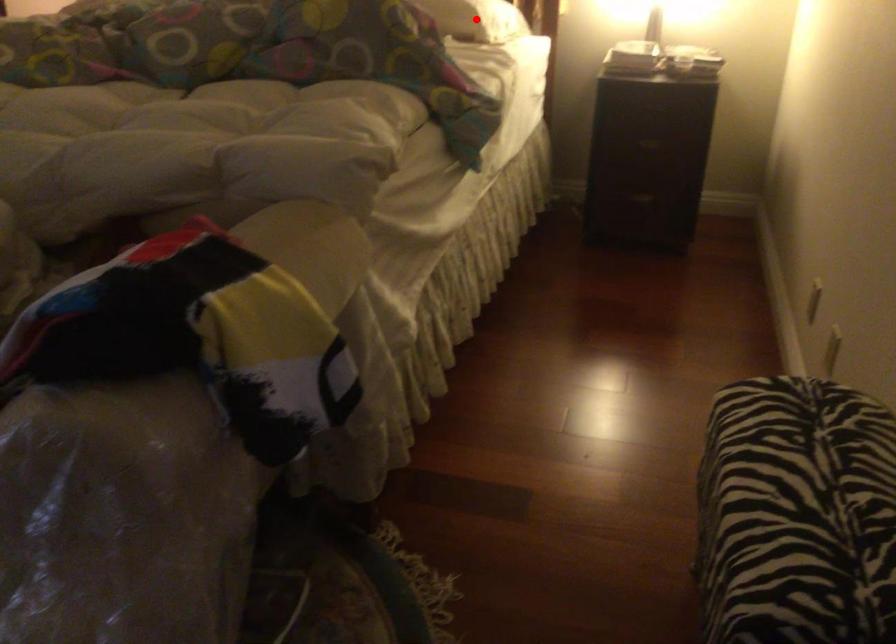
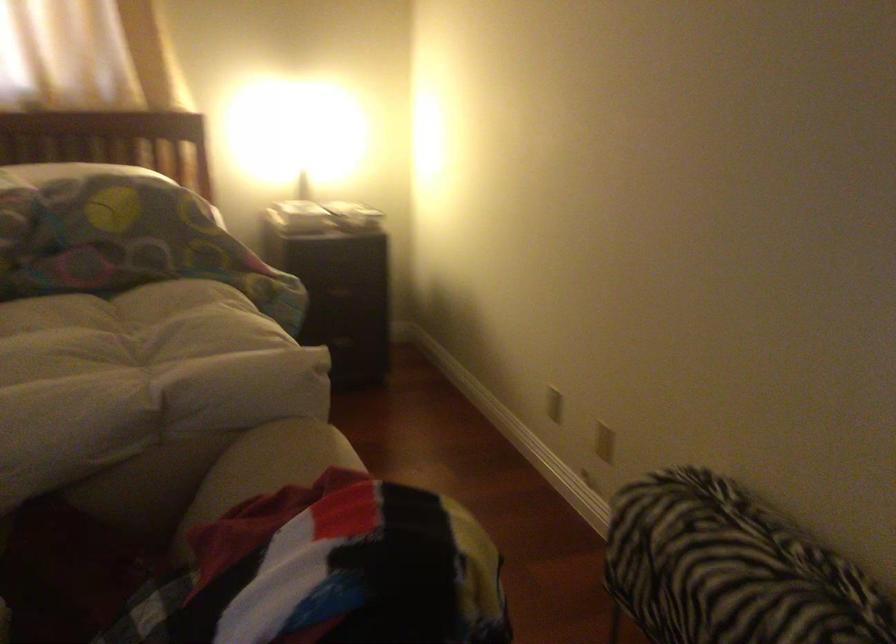
Question: I am providing you with two images of the same scene from different viewpoints. A red point is marked on the first image. Can you still see the location of the red point in image 2?

Choices:
 (A) Yes
 (B) No

Answer: (B)